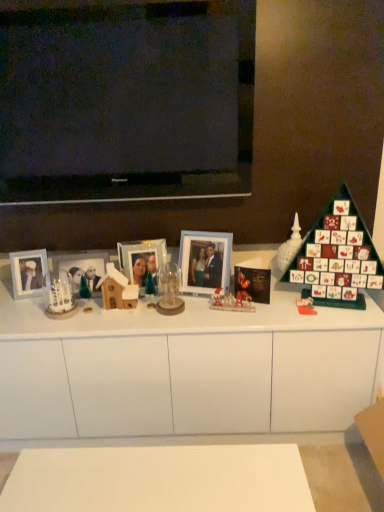
The image size is (384, 512). What do you see at coordinates (337, 256) in the screenshot?
I see `green matte advent calendar at right` at bounding box center [337, 256].

At what (x,y) coordinates should I click in order to perform the action: click on wooden house at center, the first toy from the left. Please return your answer as a coordinate pair (x, y). Image resolution: width=384 pixels, height=512 pixels. Looking at the image, I should click on (117, 290).

This screenshot has width=384, height=512. What do you see at coordinates (231, 303) in the screenshot? I see `translucent plastic figurines at center, placed as the 3th toy when sorted from left to right` at bounding box center [231, 303].

This screenshot has width=384, height=512. What do you see at coordinates (83, 270) in the screenshot?
I see `matte glass picture frame at center, the 3th picture frame positioned from the right` at bounding box center [83, 270].

I want to click on green matte advent calendar at right, so click(337, 256).

Does clear glass ornament at center, positioned as the fourth toy in right-to-left order, have a smaller size compared to green matte advent calendar at right?

Yes.

From the image's perspective, is clear glass ornament at center, which is counted as the second toy, starting from the left, on green matte advent calendar at right?

No, from the image's perspective, clear glass ornament at center, which is counted as the second toy, starting from the left, is not over green matte advent calendar at right.

Are clear glass ornament at center, which is counted as the second toy, starting from the left, and green matte advent calendar at right beside each other?

No, clear glass ornament at center, which is counted as the second toy, starting from the left, is not next to green matte advent calendar at right.

Does point (222, 297) appear closer or farther from the camera than point (287, 258)?

Clearly, point (222, 297) is closer to the camera than point (287, 258).

Which object is closer to the camera, translucent plastic figurines at center, placed as the third toy when sorted from right to left, or white glossy advent calendar at right, which is counted as the 2th toy, starting from the right?

translucent plastic figurines at center, placed as the third toy when sorted from right to left, is more forward.

Could you measure the distance between translucent plastic figurines at center, placed as the third toy when sorted from right to left, and white glossy advent calendar at right, which is counted as the 2th toy, starting from the right?

They are 11.45 inches apart.

This screenshot has height=512, width=384. In order to click on the 3rd toy positioned below the white glossy advent calendar at right, which is counted as the 2th toy, starting from the right (from a real-world perspective) in this screenshot , I will do `click(231, 303)`.

What's the angular difference between matte plastic toy at right, arranged as the first toy when viewed from the right, and white glossy advent calendar at right, acting as the fourth toy starting from the left,'s facing directions?

The facing directions of matte plastic toy at right, arranged as the first toy when viewed from the right, and white glossy advent calendar at right, acting as the fourth toy starting from the left, are 13 degrees apart.

Is matte plastic toy at right, arranged as the first toy when viewed from the right, next to white glossy advent calendar at right, which is counted as the 2th toy, starting from the right, and touching it?

No, matte plastic toy at right, arranged as the first toy when viewed from the right, is not with white glossy advent calendar at right, which is counted as the 2th toy, starting from the right.

Is matte plastic toy at right, the 5th toy viewed from the left, spatially inside white glossy advent calendar at right, acting as the fourth toy starting from the left, or outside of it?

matte plastic toy at right, the 5th toy viewed from the left, lies outside white glossy advent calendar at right, acting as the fourth toy starting from the left.

Does point (309, 304) come closer to viewer compared to point (277, 252)?

That is True.

Considering the sizes of objects black glossy television at upper center and clear glass ornament at center, which is counted as the second toy, starting from the left, in the image provided, who is smaller, black glossy television at upper center or clear glass ornament at center, which is counted as the second toy, starting from the left,?

With smaller size is clear glass ornament at center, which is counted as the second toy, starting from the left.

Consider the image. From the image's perspective, is black glossy television at upper center on clear glass ornament at center, positioned as the fourth toy in right-to-left order?

Yes.

Based on the photo, which object is closer to the camera taking this photo, black glossy television at upper center or clear glass ornament at center, which is counted as the second toy, starting from the left?

black glossy television at upper center is closer to the camera.

Are black glossy television at upper center and clear glass ornament at center, which is counted as the second toy, starting from the left, located far from each other?

Yes, black glossy television at upper center and clear glass ornament at center, which is counted as the second toy, starting from the left, are quite far apart.

Who is taller, translucent plastic figurines at center, placed as the third toy when sorted from right to left, or clear glass ornament at center, which is counted as the second toy, starting from the left?

Standing taller between the two is clear glass ornament at center, which is counted as the second toy, starting from the left.

Is the surface of translucent plastic figurines at center, placed as the third toy when sorted from right to left, in direct contact with clear glass ornament at center, positioned as the fourth toy in right-to-left order?

No, translucent plastic figurines at center, placed as the third toy when sorted from right to left, is not beside clear glass ornament at center, positioned as the fourth toy in right-to-left order.

Which is in front, translucent plastic figurines at center, placed as the 3th toy when sorted from left to right, or clear glass ornament at center, positioned as the fourth toy in right-to-left order?

clear glass ornament at center, positioned as the fourth toy in right-to-left order, is closer to the camera.

At what (x,y) coordinates should I click in order to perform the action: click on toy that is the 2nd one when counting backward from the clear glass ornament at center, which is counted as the second toy, starting from the left. Please return your answer as a coordinate pair (x, y). This screenshot has height=512, width=384. Looking at the image, I should click on (231, 303).

Does wooden house at center, arranged as the fifth toy when viewed from the right, lie behind white matte cabinet at center?

Yes, it is behind white matte cabinet at center.

Considering the sizes of objects wooden house at center, the first toy from the left, and white matte cabinet at center in the image provided, who is smaller, wooden house at center, the first toy from the left, or white matte cabinet at center?

wooden house at center, the first toy from the left.

Consider the image. Between wooden house at center, arranged as the fifth toy when viewed from the right, and white matte cabinet at center, which one has more height?

white matte cabinet at center is taller.

Is wooden house at center, arranged as the fifth toy when viewed from the right, not within white matte cabinet at center?

Yes, wooden house at center, arranged as the fifth toy when viewed from the right, is not within white matte cabinet at center.

Considering the relative sizes of white glossy advent calendar at right, acting as the fourth toy starting from the left, and metallic silver picture frame at center, acting as the 2th picture frame starting from the right, in the image provided, is white glossy advent calendar at right, acting as the fourth toy starting from the left, thinner than metallic silver picture frame at center, acting as the 2th picture frame starting from the right,?

In fact, white glossy advent calendar at right, acting as the fourth toy starting from the left, might be wider than metallic silver picture frame at center, acting as the 2th picture frame starting from the right.

Is white glossy advent calendar at right, which is counted as the 2th toy, starting from the right, to the left or to the right of metallic silver picture frame at center, acting as the 2th picture frame starting from the right, in the image?

white glossy advent calendar at right, which is counted as the 2th toy, starting from the right, is to the right of metallic silver picture frame at center, acting as the 2th picture frame starting from the right.

From the image's perspective, which one is positioned higher, white glossy advent calendar at right, acting as the fourth toy starting from the left, or metallic silver picture frame at center, the third picture frame from the left?

white glossy advent calendar at right, acting as the fourth toy starting from the left, is shown above in the image.

Is white glossy advent calendar at right, which is counted as the 2th toy, starting from the right, not near metallic silver picture frame at center, acting as the 2th picture frame starting from the right?

That's not correct — white glossy advent calendar at right, which is counted as the 2th toy, starting from the right, is a little close to metallic silver picture frame at center, acting as the 2th picture frame starting from the right.

There is a green matte advent calendar at right. Identify the location of the 3rd toy below it (from the image's perspective). (169, 290).

Identify the location of toy that is the 1st object to the right of the translucent plastic figurines at center, placed as the third toy when sorted from right to left, starting at the anchor. (289, 246).

Estimate the real-world distances between objects in this image. Which object is closer to white glossy advent calendar at right, which is counted as the 2th toy, starting from the right, green matte advent calendar at right or wooden house at center, the first toy from the left?

green matte advent calendar at right is closer to white glossy advent calendar at right, which is counted as the 2th toy, starting from the right.

Consider the image. Based on their spatial positions, is white matte cabinet at center or white glossy advent calendar at right, which is counted as the 2th toy, starting from the right, closer to translucent plastic figurines at center, placed as the third toy when sorted from right to left?

white glossy advent calendar at right, which is counted as the 2th toy, starting from the right, is closer to translucent plastic figurines at center, placed as the third toy when sorted from right to left.

From the image, which object appears to be farther from white frosted glass candle holder at left, translucent plastic figurines at center, placed as the third toy when sorted from right to left, or matte plastic toy at right, the 5th toy viewed from the left?

Among the two, matte plastic toy at right, the 5th toy viewed from the left, is located further to white frosted glass candle holder at left.

Which object lies further to the anchor point translucent plastic figurines at center, placed as the third toy when sorted from right to left, wooden house at center, the first toy from the left, or matte plastic toy at right, the 5th toy viewed from the left?

Among the two, wooden house at center, the first toy from the left, is located further to translucent plastic figurines at center, placed as the third toy when sorted from right to left.

When comparing their distances from matte silver picture frame at left, marked as the 1th picture frame in a left-to-right arrangement, does white matte cabinet at center or metallic silver picture frame at center, the third picture frame from the left, seem closer?

The object closer to matte silver picture frame at left, marked as the 1th picture frame in a left-to-right arrangement, is metallic silver picture frame at center, the third picture frame from the left.

Which object lies further to the anchor point clear glass ornament at center, which is counted as the second toy, starting from the left, white matte cabinet at center or metallic silver picture frame at center, acting as the 2th picture frame starting from the right?

white matte cabinet at center is further to clear glass ornament at center, which is counted as the second toy, starting from the left.

From the image, which object appears to be farther from wooden house at center, arranged as the fifth toy when viewed from the right, black glossy television at upper center or matte plastic toy at right, arranged as the first toy when viewed from the right?

black glossy television at upper center lies further to wooden house at center, arranged as the fifth toy when viewed from the right, than the other object.

Based on their spatial positions, is metallic silver picture frame at center, the third picture frame from the left, or wooden house at center, the first toy from the left, closer to clear glass ornament at center, which is counted as the second toy, starting from the left?

metallic silver picture frame at center, the third picture frame from the left.

Where is `television situated between matte silver picture frame at left, which is counted as the fourth picture frame, starting from the right, and matte glass photo frame at center, the first picture frame in the right-to-left sequence, from left to right`? This screenshot has width=384, height=512. television situated between matte silver picture frame at left, which is counted as the fourth picture frame, starting from the right, and matte glass photo frame at center, the first picture frame in the right-to-left sequence, from left to right is located at coordinates (126, 101).

Locate an element on the screen. This screenshot has width=384, height=512. picture frame located between matte glass picture frame at center, which is the second picture frame from left to right, and matte glass photo frame at center, the first picture frame in the right-to-left sequence, in the left-right direction is located at coordinates [141, 261].

I want to click on television located between white frosted glass candle holder at left and white glossy advent calendar at right, acting as the fourth toy starting from the left, in the left-right direction, so click(126, 101).

At what (x,y) coordinates should I click in order to perform the action: click on cabinetry between matte glass picture frame at center, which is the second picture frame from left to right, and translucent plastic figurines at center, placed as the 3th toy when sorted from left to right. Please return your answer as a coordinate pair (x, y). Looking at the image, I should click on (185, 370).